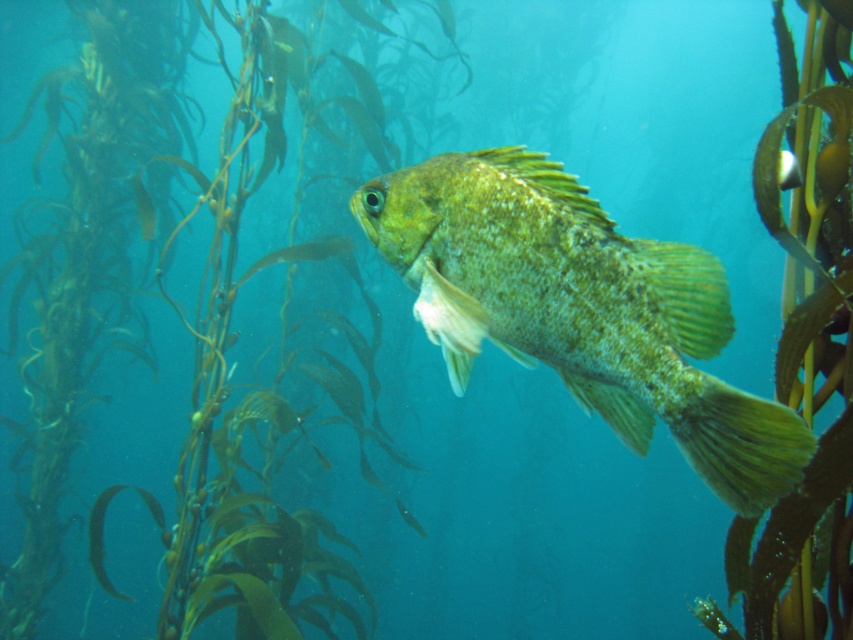
Is green textured fish at center below green leafy plant at center?

No, green textured fish at center is not below green leafy plant at center.

What do you see at coordinates (579, 308) in the screenshot?
I see `green textured fish at center` at bounding box center [579, 308].

The image size is (853, 640). Find the location of `green textured fish at center`. green textured fish at center is located at coordinates (579, 308).